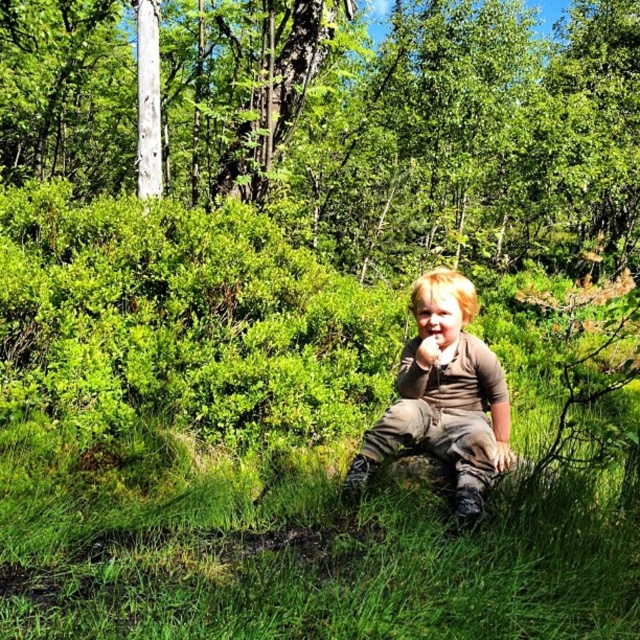
Can you confirm if green leafy tree at upper center is bigger than brown textured shirt at center?

Correct, green leafy tree at upper center is larger in size than brown textured shirt at center.

What do you see at coordinates (419, 129) in the screenshot? I see `green leafy tree at upper center` at bounding box center [419, 129].

Between point (584, 61) and point (436, 353), which one is positioned behind?

The point (584, 61) is more distant.

You are a GUI agent. You are given a task and a screenshot of the screen. Output one action in this format:
    pyautogui.click(x=<x>, y=<y>)
    Task: Click on the green leafy tree at upper center
    
    Given the screenshot: What is the action you would take?
    pyautogui.click(x=419, y=129)